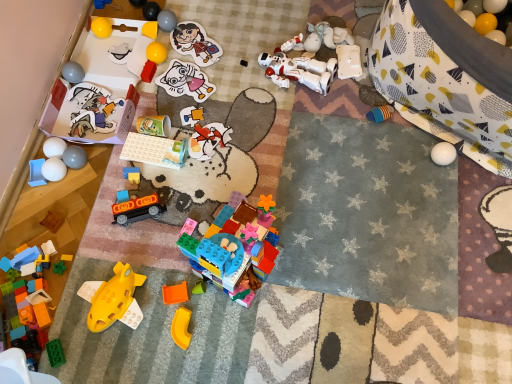
Locate an element on the screen. This screenshot has width=512, height=384. vacant area in front of orange matte train at center, which is the twelfth toy in right-to-left order is located at coordinates (136, 264).